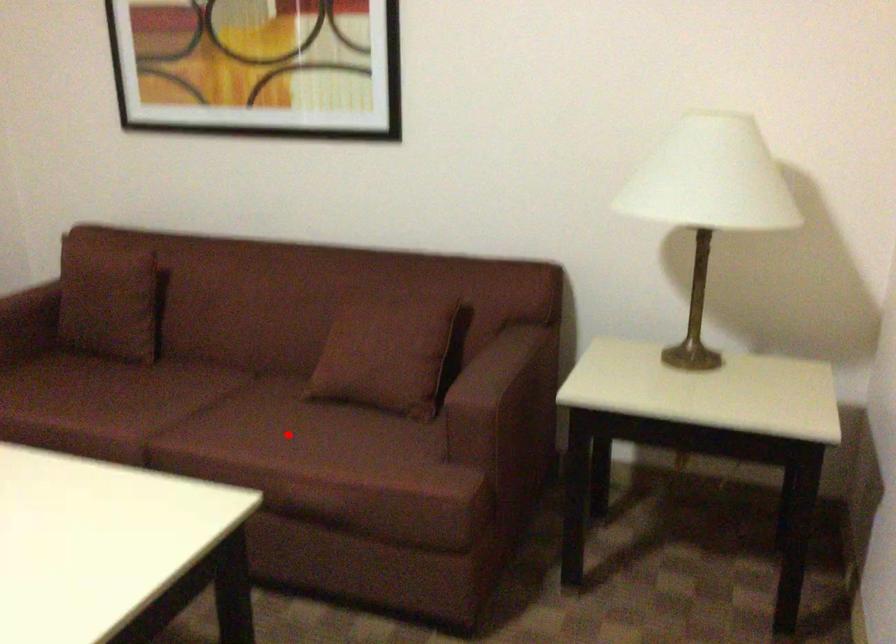
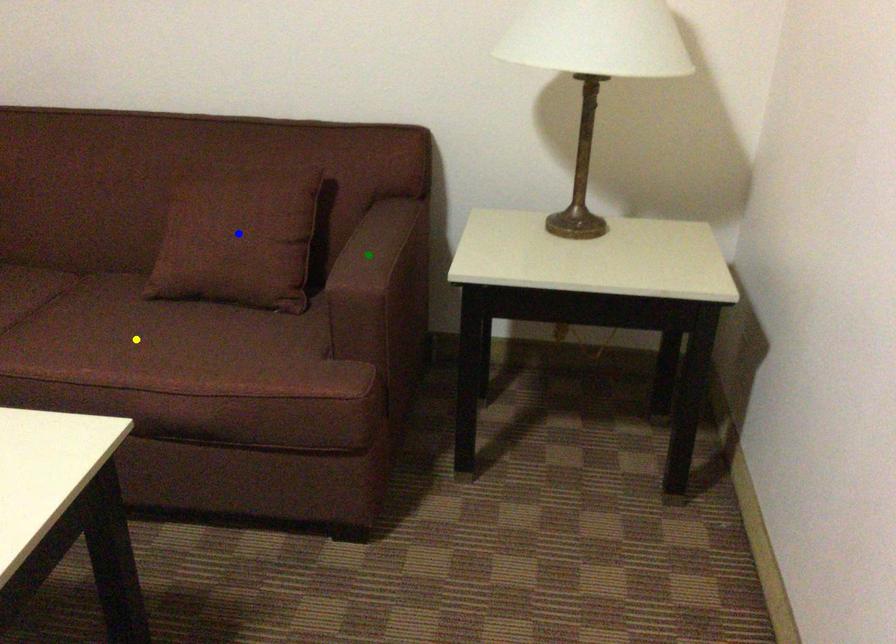
Question: I am providing you with two images of the same scene from different viewpoints. A red point is marked on the first image. You are given multiple points on the second image. Which point in image 2 represents the same 3d spot as the red point in image 1?

Choices:
 (A) yellow point
 (B) blue point
 (C) green point

Answer: (A)